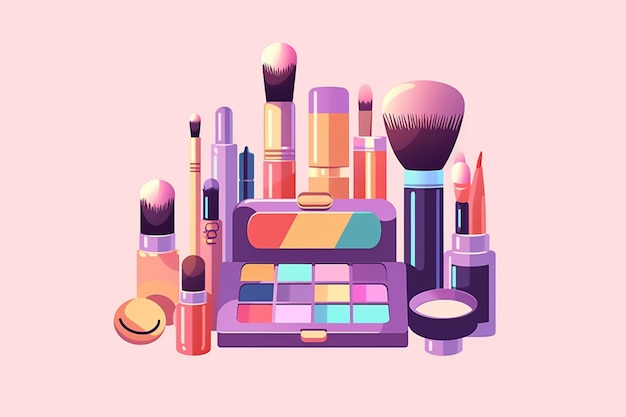
This screenshot has height=417, width=626. Find the location of `makeup`. makeup is located at coordinates (227, 158), (331, 133), (454, 315).